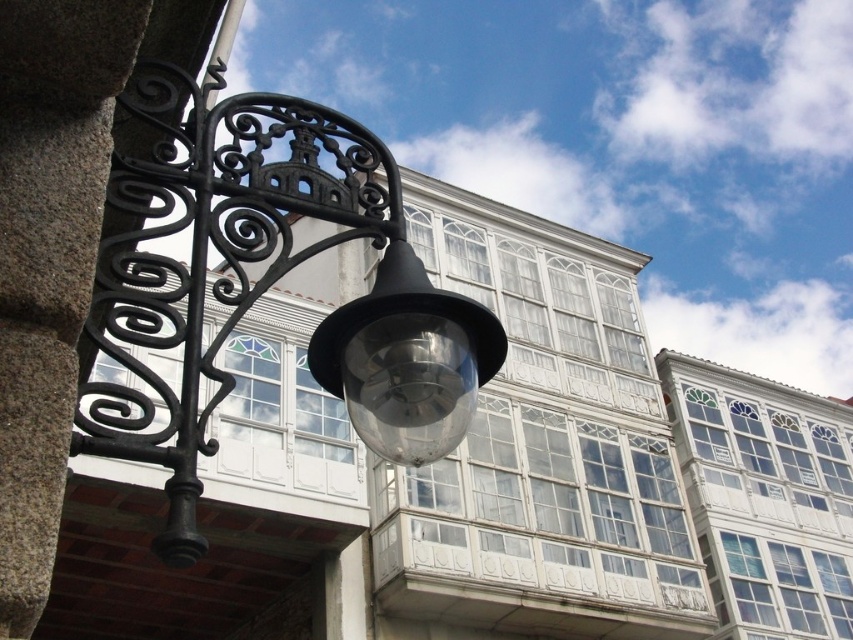
Between transparent glass light fixture at center and black wrought iron at left, which one is positioned higher?

Positioned higher is black wrought iron at left.

Does transparent glass light fixture at center appear on the left side of black wrought iron at left?

No, transparent glass light fixture at center is not to the left of black wrought iron at left.

Which is in front, point (438, 289) or point (239, 10)?

Point (239, 10) is in front.

This screenshot has width=853, height=640. In order to click on transparent glass light fixture at center in this screenshot , I will do `click(407, 360)`.

Can you confirm if matte black lamp at left is taller than transparent glass light fixture at center?

Yes, matte black lamp at left is taller than transparent glass light fixture at center.

Is point (360, 202) more distant than point (312, 355)?

Yes, point (360, 202) is behind point (312, 355).

Between point (349, 308) and point (438, 424), which one is positioned in front?

Point (438, 424) is in front.

What are the coordinates of `matte black lamp at left` in the screenshot? It's located at (268, 285).

Does matte black lamp at left come behind black wrought iron at left?

That is False.

Which is in front, point (167, 436) or point (212, 93)?

Point (167, 436) is more forward.

The width and height of the screenshot is (853, 640). Identify the location of matte black lamp at left. (268, 285).

Identify the location of matte black lamp at left. This screenshot has width=853, height=640. (268, 285).